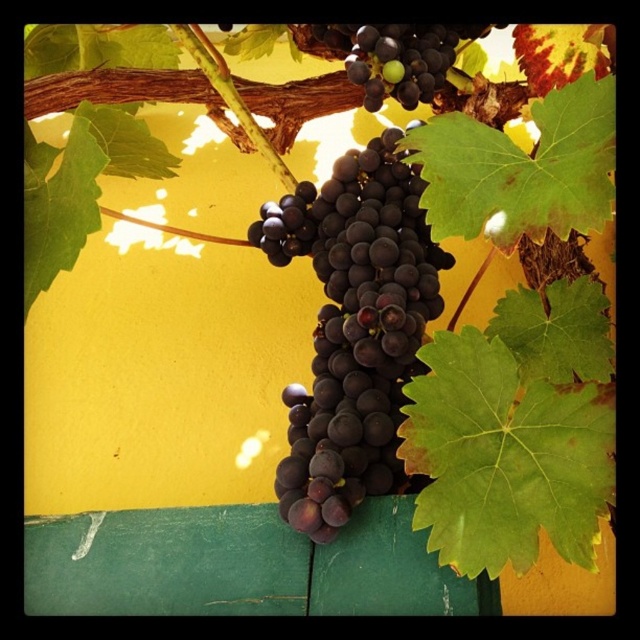
The image size is (640, 640). Describe the element at coordinates (353, 326) in the screenshot. I see `shiny dark purple grapes at center` at that location.

Which is below, shiny dark purple grapes at center or shiny dark purple grapes at upper center?

shiny dark purple grapes at center is lower down.

Locate an element on the screen. The width and height of the screenshot is (640, 640). shiny dark purple grapes at center is located at coordinates (353, 326).